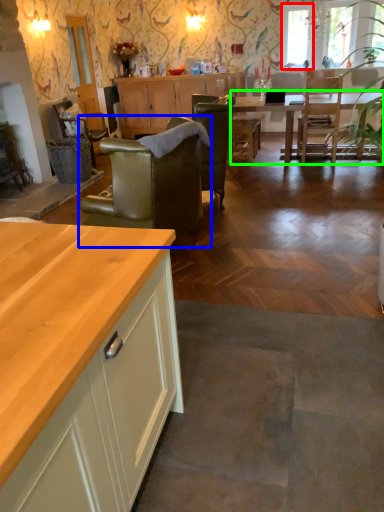
Question: Considering the real-world distances, which object is closest to window screen (highlighted by a red box)? chair (highlighted by a blue box) or kitchen & dining room table (highlighted by a green box).

Choices:
 (A) chair
 (B) kitchen & dining room table

Answer: (B)